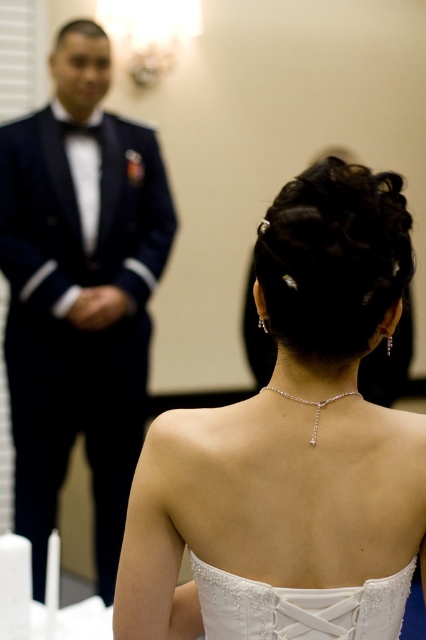
You are a photographer at a formal event and need to position a light source to highlight the shiny black suit at left. Given the coordinates provided in the description, where should you place the light relative to the suit to achieve the best reflection?

The shiny black suit at left is located at point coordinates, so placing the light source directly in front of the suit at those coordinates would best capture its reflective surface.

You are a photographer at a wedding venue and need to adjust the lighting between the white satin dress at center and the white lace dress at back. The minimum distance required for proper lighting adjustment is 20 centimeters. Based on the scene, can you safely adjust the lighting between them?

The white satin dress at center is only 18.10 centimeters away from the white lace dress at back, which is less than the required 20 centimeters. Therefore, you cannot safely adjust the lighting between them without risking interference between the dresses.

Looking at this image, based on the scene description, where is the white satin dress at center in relation to the shiny black suit at left?

The white satin dress at center is to the right of the shiny black suit at left.